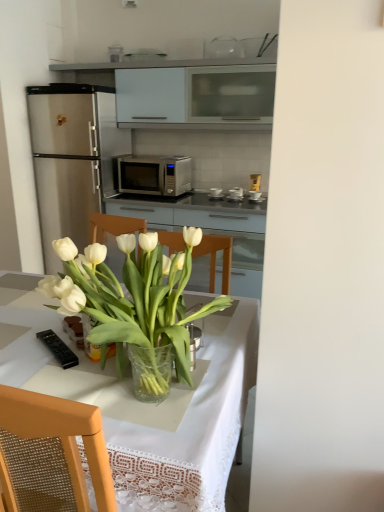
Question: Does translucent glass vase at center lie behind metallic silver toaster at center, positioned as the 2th appliance in bottom-to-top order?

Choices:
 (A) yes
 (B) no

Answer: (B)

Question: Can you confirm if translucent glass vase at center is thinner than metallic silver toaster at center, positioned as the 2th appliance in bottom-to-top order?

Choices:
 (A) yes
 (B) no

Answer: (B)

Question: Would you say translucent glass vase at center contains metallic silver toaster at center, arranged as the second appliance when viewed from the front?

Choices:
 (A) no
 (B) yes

Answer: (A)

Question: Is translucent glass vase at center turned away from metallic silver toaster at center, which ranks as the second appliance in left-to-right order?

Choices:
 (A) yes
 (B) no

Answer: (B)

Question: Is translucent glass vase at center placed right next to metallic silver toaster at center, arranged as the second appliance when viewed from the front?

Choices:
 (A) yes
 (B) no

Answer: (B)

Question: Is translucent glass vase at center positioned far away from metallic silver toaster at center, the 1th appliance in the right-to-left sequence?

Choices:
 (A) yes
 (B) no

Answer: (A)

Question: Is transparent glass vase at center facing away from translucent glass vase at center?

Choices:
 (A) yes
 (B) no

Answer: (B)

Question: Does transparent glass vase at center have a greater height compared to translucent glass vase at center?

Choices:
 (A) no
 (B) yes

Answer: (B)

Question: From the image's perspective, does transparent glass vase at center appear lower than translucent glass vase at center?

Choices:
 (A) no
 (B) yes

Answer: (B)

Question: Is transparent glass vase at center to the right of translucent glass vase at center from the viewer's perspective?

Choices:
 (A) yes
 (B) no

Answer: (B)

Question: Is the depth of transparent glass vase at center greater than that of translucent glass vase at center?

Choices:
 (A) yes
 (B) no

Answer: (B)

Question: Is transparent glass vase at center to the left of translucent glass vase at center from the viewer's perspective?

Choices:
 (A) no
 (B) yes

Answer: (B)

Question: Does black plastic remote control at lower left, which ranks as the 2th appliance in back-to-front order, lie in front of satin silver microwave at center?

Choices:
 (A) yes
 (B) no

Answer: (A)